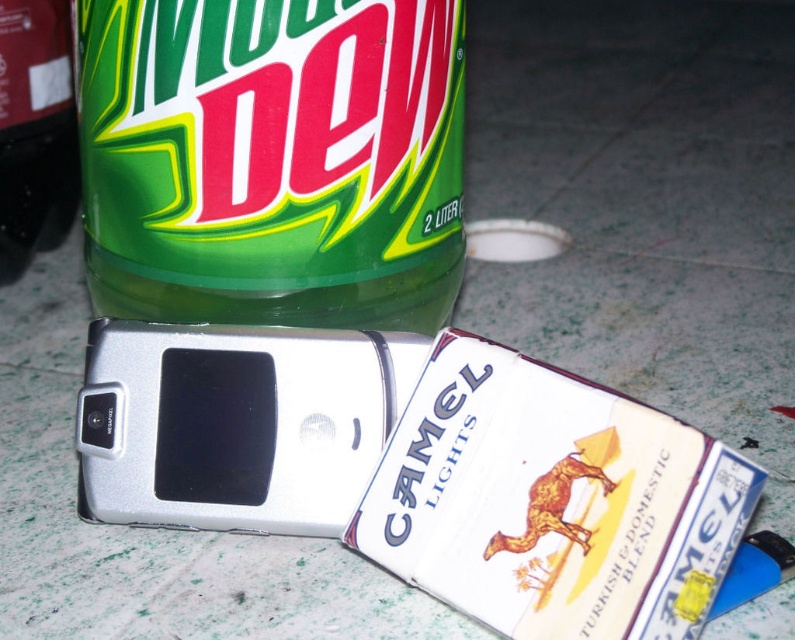
Please look at the image and locate the point at coordinates (272, 160). What object is this point located on?

The point at coordinates (272, 160) is located on the green matte plastic bottle at upper left.

You are organizing items on a countertop. You have a silver metallic phone at center and a green matte bottle at upper left. Which item takes up more space on the countertop?

The green matte bottle at upper left takes up more space on the countertop because the silver metallic phone at center has a smaller size compared to it.

Based on the photo, you are organizing items on a countertop and need to move the silver metallic phone at center to the front. Can you move it without moving the green matte plastic bottle at upper left?

The silver metallic phone at center is behind the green matte plastic bottle at upper left, so you cannot move the silver metallic phone at center to the front without moving the green matte plastic bottle at upper left first.